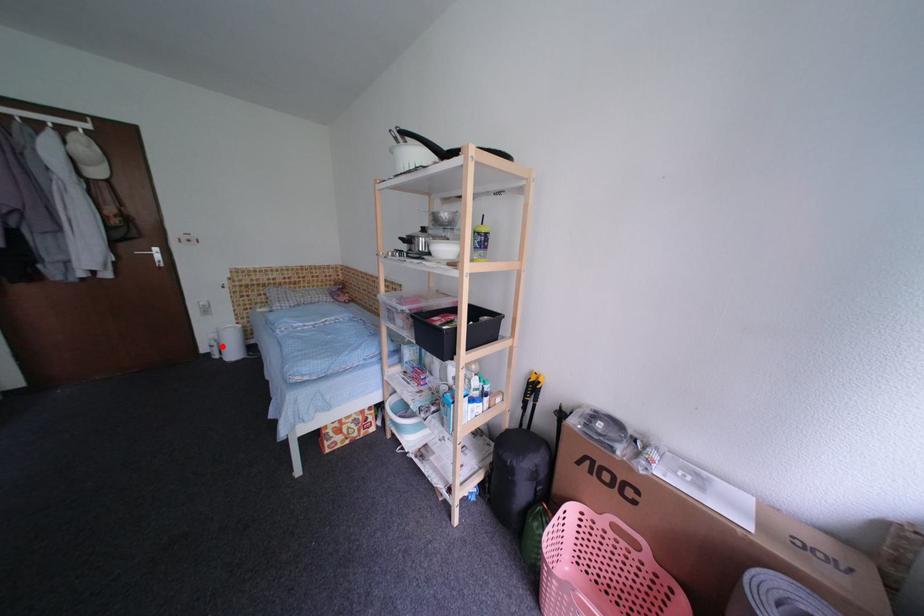
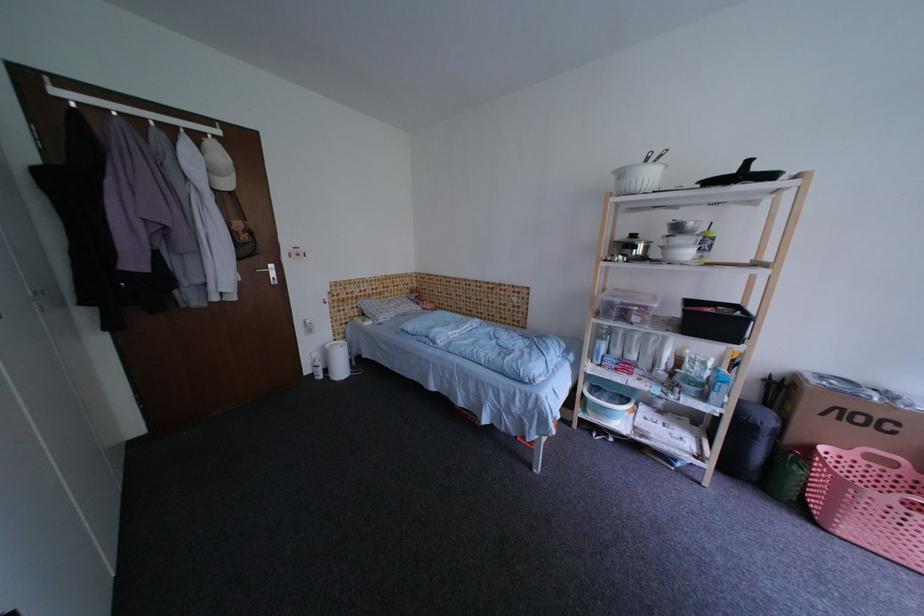
Question: I am providing you with two images of the same scene from different viewpoints. Image1 has a red point marked. In image2, the corresponding 3D location appears at what relative position? Reply with the corresponding letter.

Choices:
 (A) Closer
 (B) Farther

Answer: (B)